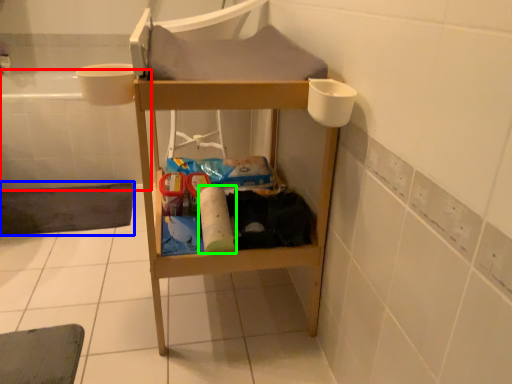
Question: Which object is positioned closest to bath (highlighted by a red box)? Select from bath mat (highlighted by a blue box) and toilet paper (highlighted by a green box).

Choices:
 (A) bath mat
 (B) toilet paper

Answer: (A)